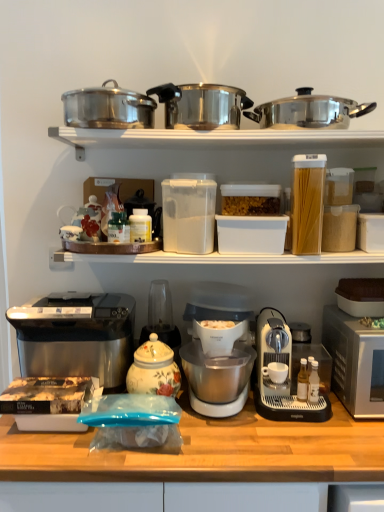
Question: Looking at their shapes, would you say metallic silver coffee maker at lower right, which is counted as the first coffee maker, starting from the right, is wider or thinner than polished stainless steel pot at upper right, the 1th kitchen appliance when ordered from right to left?

Choices:
 (A) wide
 (B) thin

Answer: (A)

Question: From a real-world perspective, relative to polished stainless steel pot at upper right, which is counted as the 4th kitchen appliance, starting from the left, is metallic silver coffee maker at lower right, which is counted as the first coffee maker, starting from the right, vertically above or below?

Choices:
 (A) below
 (B) above

Answer: (A)

Question: Estimate the real-world distances between objects in this image. Which object is farther from the metallic silver coffee maker at lower right, which is counted as the first coffee maker, starting from the right?

Choices:
 (A) porcelain floral jar at center, arranged as the 1th appliance when viewed from the left
 (B) clear plastic bag at center
 (C) metallic pots at upper center
 (D) shiny metallic pot at upper left, which ranks as the third kitchen appliance in top-to-bottom order
 (E) white matte coffee cup at center

Answer: (D)

Question: Based on their relative distances, which object is nearer to the shiny metallic pot at upper left, which ranks as the third kitchen appliance in top-to-bottom order?

Choices:
 (A) matte brown cake pan at right, the 2th appliance from the right
 (B) metallic pots at upper center
 (C) metallic silver coffee maker at lower right, which is counted as the first coffee maker, starting from the right
 (D) polished stainless steel pressure cooker at upper center, the second kitchen appliance positioned from the right
 (E) white matte coffee cup at center

Answer: (D)